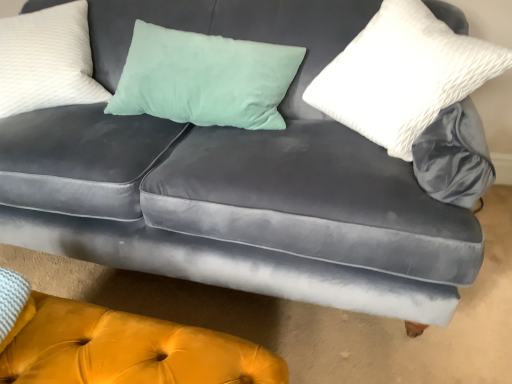
This screenshot has width=512, height=384. What are the coordinates of `velvet yellow ottoman at lower center` in the screenshot? It's located at (117, 346).

The height and width of the screenshot is (384, 512). I want to click on white textured pillow at upper left, positioned as the 1th pillow in left-to-right order, so click(47, 60).

Describe the element at coordinates (402, 75) in the screenshot. The width and height of the screenshot is (512, 384). I see `white textured pillow at upper right, positioned as the 2th pillow in left-to-right order` at that location.

What is the approximate width of white textured pillow at upper right, positioned as the 2th pillow in left-to-right order?

10.74 inches.

Locate an element on the screen. velvet yellow ottoman at lower center is located at coordinates (117, 346).

Who is more distant, velvet yellow ottoman at lower center or white textured pillow at upper right, positioned as the 2th pillow in left-to-right order?

white textured pillow at upper right, positioned as the 2th pillow in left-to-right order.

Which point is more distant from viewer, (x=18, y=362) or (x=361, y=125)?

The point (x=361, y=125) is behind.

From a real-world perspective, starting from the velvet yellow ottoman at lower center, which pillow is the 2nd one vertically above it? Please provide its 2D coordinates.

[(402, 75)]

Is the depth of white textured pillow at upper left, the second pillow from the right, greater than that of velvet yellow ottoman at lower center?

Yes, it is.

From a real-world perspective, who is located lower, white textured pillow at upper left, positioned as the 1th pillow in left-to-right order, or velvet yellow ottoman at lower center?

In real-world perspective, velvet yellow ottoman at lower center is lower.

Based on their positions, is white textured pillow at upper left, positioned as the 1th pillow in left-to-right order, located to the left or right of velvet yellow ottoman at lower center?

white textured pillow at upper left, positioned as the 1th pillow in left-to-right order, is positioned on velvet yellow ottoman at lower center's left side.

From the image's perspective, is white textured pillow at upper left, positioned as the 1th pillow in left-to-right order, over velvet yellow ottoman at lower center?

Yes.

From a real-world perspective, which object rests below the other?

velvet yellow ottoman at lower center is physically lower.

Is velvet yellow ottoman at lower center not within white textured pillow at upper left, the second pillow from the right?

Yes, velvet yellow ottoman at lower center is not within white textured pillow at upper left, the second pillow from the right.

The width and height of the screenshot is (512, 384). Identify the location of couch below the white textured pillow at upper left, positioned as the 1th pillow in left-to-right order (from the image's perspective). (117, 346).

From the image's perspective, who appears lower, velvet yellow ottoman at lower center or white textured pillow at upper left, the second pillow from the right?

velvet yellow ottoman at lower center is shown below in the image.

Is white textured pillow at upper left, positioned as the 1th pillow in left-to-right order, behind white textured pillow at upper right, arranged as the 1th pillow when viewed from the right?

Yes, white textured pillow at upper left, positioned as the 1th pillow in left-to-right order, is further from the viewer.

At what (x,y) coordinates should I click in order to perform the action: click on pillow below the white textured pillow at upper left, the second pillow from the right (from the image's perspective). Please return your answer as a coordinate pair (x, y). The width and height of the screenshot is (512, 384). Looking at the image, I should click on (402, 75).

How much distance is there between white textured pillow at upper left, the second pillow from the right, and white textured pillow at upper right, arranged as the 1th pillow when viewed from the right?

white textured pillow at upper left, the second pillow from the right, and white textured pillow at upper right, arranged as the 1th pillow when viewed from the right, are 3.31 feet apart from each other.

How different are the orientations of white textured pillow at upper left, positioned as the 1th pillow in left-to-right order, and white textured pillow at upper right, arranged as the 1th pillow when viewed from the right, in degrees?

They differ by 81.2 degrees in their facing directions.

Is white textured pillow at upper right, positioned as the 2th pillow in left-to-right order, positioned beyond the bounds of velvet yellow ottoman at lower center?

Indeed, white textured pillow at upper right, positioned as the 2th pillow in left-to-right order, is completely outside velvet yellow ottoman at lower center.

Is white textured pillow at upper right, positioned as the 2th pillow in left-to-right order, thinner than velvet yellow ottoman at lower center?

Yes, white textured pillow at upper right, positioned as the 2th pillow in left-to-right order, is thinner than velvet yellow ottoman at lower center.

Does white textured pillow at upper right, positioned as the 2th pillow in left-to-right order, appear on the right side of velvet yellow ottoman at lower center?

Yes.

Is white textured pillow at upper right, positioned as the 2th pillow in left-to-right order, taller than white textured pillow at upper left, positioned as the 1th pillow in left-to-right order?

Yes.

Is white textured pillow at upper right, arranged as the 1th pillow when viewed from the right, wider or thinner than white textured pillow at upper left, positioned as the 1th pillow in left-to-right order?

In the image, white textured pillow at upper right, arranged as the 1th pillow when viewed from the right, appears to be more narrow than white textured pillow at upper left, positioned as the 1th pillow in left-to-right order.

Between white textured pillow at upper right, arranged as the 1th pillow when viewed from the right, and white textured pillow at upper left, the second pillow from the right, which one appears on the left side from the viewer's perspective?

white textured pillow at upper left, the second pillow from the right.

The width and height of the screenshot is (512, 384). In order to click on pillow that is above the white textured pillow at upper left, the second pillow from the right (from a real-world perspective) in this screenshot , I will do `click(402, 75)`.

Find the location of a particular element. The image size is (512, 384). the 1st pillow positioned above the velvet yellow ottoman at lower center (from the image's perspective) is located at coordinates (402, 75).

I want to click on couch below the white textured pillow at upper left, the second pillow from the right (from the image's perspective), so click(x=117, y=346).

Looking at this image, looking at the image, which one is located further to white textured pillow at upper right, arranged as the 1th pillow when viewed from the right, white textured pillow at upper left, positioned as the 1th pillow in left-to-right order, or velvet yellow ottoman at lower center?

white textured pillow at upper left, positioned as the 1th pillow in left-to-right order, lies further to white textured pillow at upper right, arranged as the 1th pillow when viewed from the right, than the other object.

When comparing their distances from velvet yellow ottoman at lower center, does white textured pillow at upper right, arranged as the 1th pillow when viewed from the right, or white textured pillow at upper left, the second pillow from the right, seem closer?

The object closer to velvet yellow ottoman at lower center is white textured pillow at upper right, arranged as the 1th pillow when viewed from the right.

When comparing their distances from velvet yellow ottoman at lower center, does white textured pillow at upper left, the second pillow from the right, or white textured pillow at upper right, arranged as the 1th pillow when viewed from the right, seem closer?

white textured pillow at upper right, arranged as the 1th pillow when viewed from the right.

Based on the photo, when comparing their distances from white textured pillow at upper right, positioned as the 2th pillow in left-to-right order, does velvet yellow ottoman at lower center or white textured pillow at upper left, the second pillow from the right, seem closer?

Among the two, velvet yellow ottoman at lower center is located nearer to white textured pillow at upper right, positioned as the 2th pillow in left-to-right order.

Which object lies nearer to the anchor point white textured pillow at upper left, the second pillow from the right, velvet yellow ottoman at lower center or white textured pillow at upper right, positioned as the 2th pillow in left-to-right order?

The object closer to white textured pillow at upper left, the second pillow from the right, is velvet yellow ottoman at lower center.

Considering their positions, is white textured pillow at upper right, positioned as the 2th pillow in left-to-right order, positioned further to white textured pillow at upper left, the second pillow from the right, than velvet yellow ottoman at lower center?

white textured pillow at upper right, positioned as the 2th pillow in left-to-right order, lies further to white textured pillow at upper left, the second pillow from the right, than the other object.

The image size is (512, 384). What are the coordinates of `couch between white textured pillow at upper left, positioned as the 1th pillow in left-to-right order, and white textured pillow at upper right, arranged as the 1th pillow when viewed from the right` in the screenshot? It's located at (117, 346).